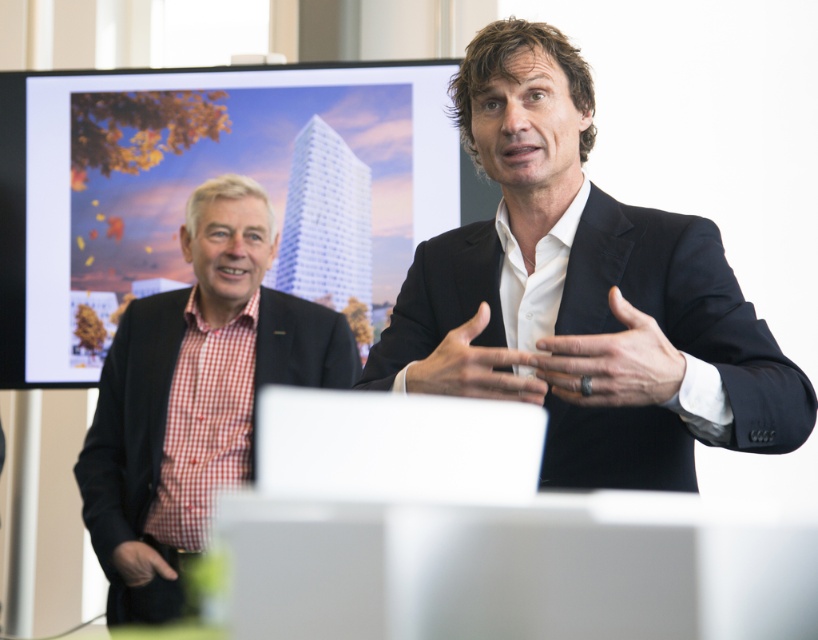
Can you confirm if matte digital display at upper left is positioned to the left of black matte hand at lower left?

No, matte digital display at upper left is not to the left of black matte hand at lower left.

Is point (75, 333) positioned after point (135, 552)?

Yes, it is behind point (135, 552).

Who is more forward, (381,296) or (167,572)?

Positioned in front is point (167,572).

Image resolution: width=818 pixels, height=640 pixels. I want to click on matte digital display at upper left, so click(x=203, y=188).

Locate an element on the screen. This screenshot has width=818, height=640. black leather hand at center is located at coordinates (474, 368).

Can you confirm if black leather hand at center is positioned above black matte hand at lower left?

Correct, black leather hand at center is located above black matte hand at lower left.

This screenshot has width=818, height=640. Identify the location of black leather hand at center. (474, 368).

Consider the image. Who is lower down, red checkered shirt at left or black leather hand at center?

Positioned lower is red checkered shirt at left.

Where is `red checkered shirt at left`? The width and height of the screenshot is (818, 640). red checkered shirt at left is located at coordinates (196, 390).

I want to click on red checkered shirt at left, so click(x=196, y=390).